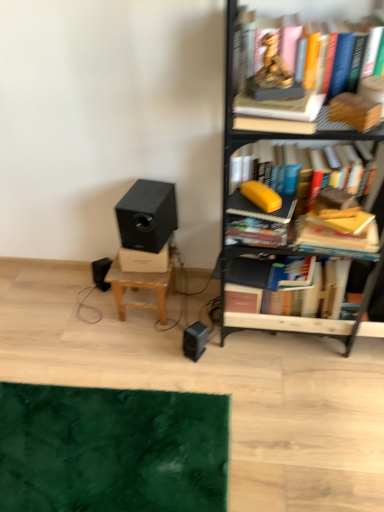
Question: From the image's perspective, is gold statue at upper center, marked as the 1th book in a top-to-bottom arrangement, above or below yellow matte book at center-right, placed as the 3th paperback book when sorted from top to bottom?

Choices:
 (A) above
 (B) below

Answer: (A)

Question: From their relative heights in the image, would you say gold statue at upper center, marked as the 1th book in a top-to-bottom arrangement, is taller or shorter than yellow matte book at center-right, which is the 1th paperback book in bottom-to-top order?

Choices:
 (A) short
 (B) tall

Answer: (B)

Question: Based on their relative distances, which object is nearer to the gold statue at upper center, marked as the 1th book in a top-to-bottom arrangement?

Choices:
 (A) black matte speaker at center-left
 (B) yellow matte pencil case at upper right, which appears as the 2th book when viewed from the top
 (C) metallic black bookcase at right
 (D) wooden book at upper right, which is the second paperback book from bottom to top
 (E) yellow matte book at center-right, which is the 1th paperback book in bottom-to-top order

Answer: (D)

Question: Which of these objects is positioned farthest from the yellow matte pencil case at upper right, the 3th book ordered from the bottom?

Choices:
 (A) gold metallic statue at upper center, the 3th paperback book from the bottom
 (B) hardcover book at center right, the 1th book ordered from the bottom
 (C) gold statue at upper center, placed as the 4th book when sorted from bottom to top
 (D) wooden book at upper right, which is the second paperback book from top to bottom
 (E) black matte speaker at center-left

Answer: (E)